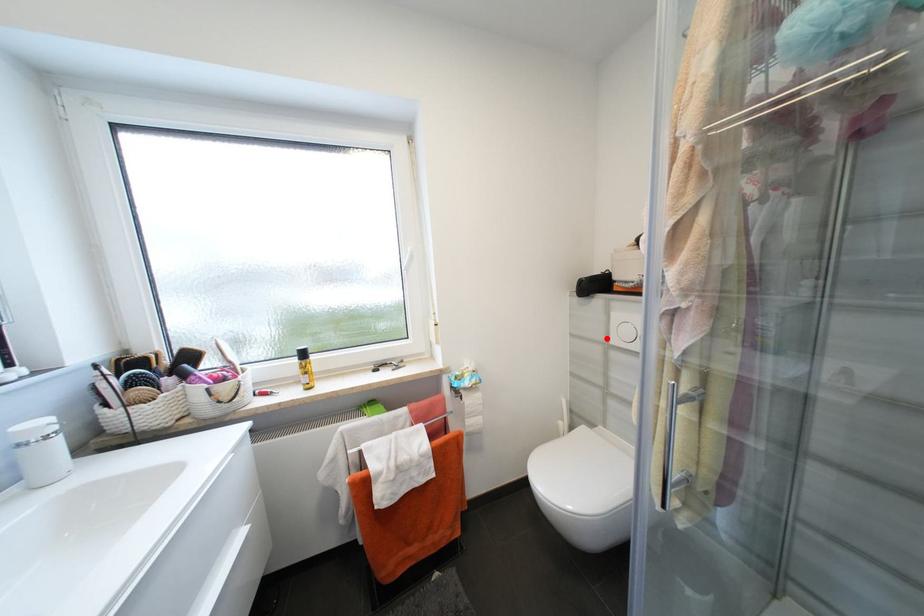
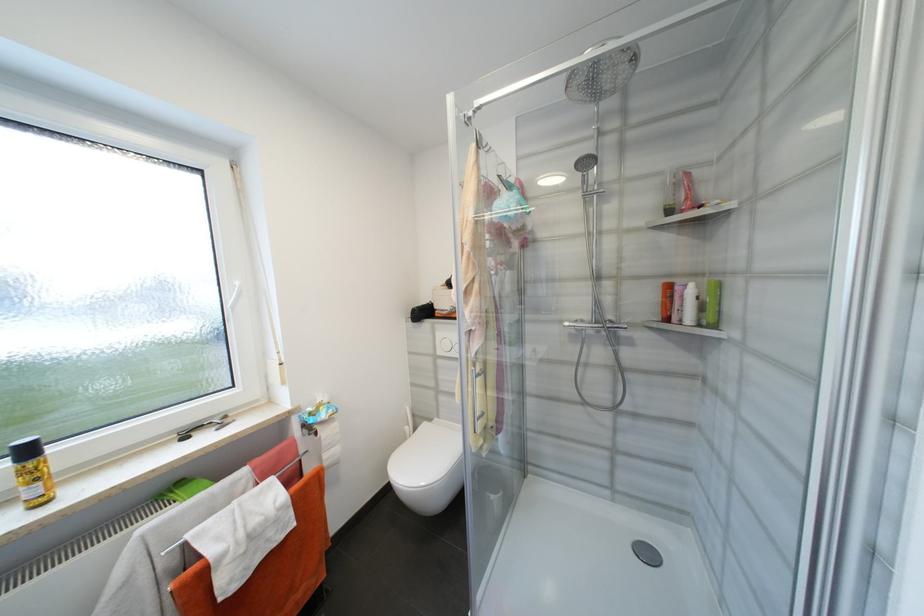
Question: I am providing you with two images of the same scene from different viewpoints. Image1 has a red point marked. In image2, the corresponding 3D location appears at what relative position? Reply with the corresponding letter.

Choices:
 (A) Closer
 (B) Farther

Answer: (B)